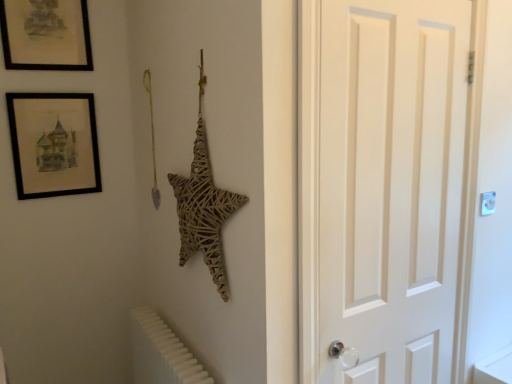
Question: Relative to black matte picture frame at upper left, the 2th picture frame from the bottom, is white plastic radiator at lower left in front or behind?

Choices:
 (A) front
 (B) behind

Answer: (A)

Question: From a real-world perspective, is white plastic radiator at lower left physically located above or below black matte picture frame at upper left, the 1th picture frame when ordered from top to bottom?

Choices:
 (A) above
 (B) below

Answer: (B)

Question: Which object is positioned closest to the black matte picture frame at upper left, placed as the second picture frame when sorted from top to bottom?

Choices:
 (A) white wooden door at right
 (B) white plastic radiator at lower left
 (C) black matte picture frame at upper left, the 1th picture frame when ordered from top to bottom
 (D) white plastic light switch at upper right

Answer: (C)

Question: Based on their relative distances, which object is farther from the black matte picture frame at upper left, placed as the second picture frame when sorted from top to bottom?

Choices:
 (A) white wooden door at right
 (B) black matte picture frame at upper left, the 2th picture frame from the bottom
 (C) white plastic light switch at upper right
 (D) white plastic radiator at lower left

Answer: (C)